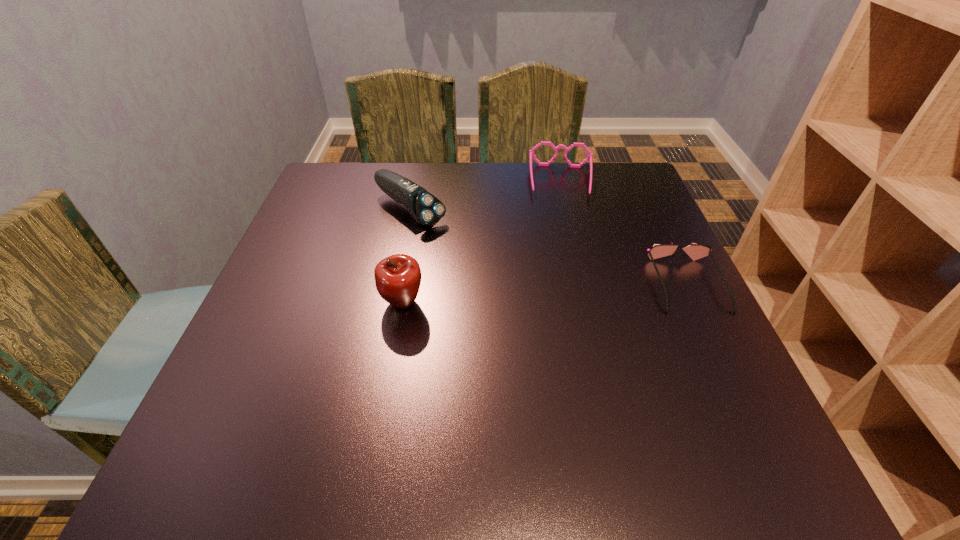
Find the location of `free spot on the desktop that is between the tallest object and the shortest object and is positioned on the head of the electric shaver`. free spot on the desktop that is between the tallest object and the shortest object and is positioned on the head of the electric shaver is located at coordinates (531, 294).

This screenshot has height=540, width=960. I want to click on vacant space on the desktop that is between the tallest object and the sunglasses and is positioned on the arms of the spectacles, so click(568, 292).